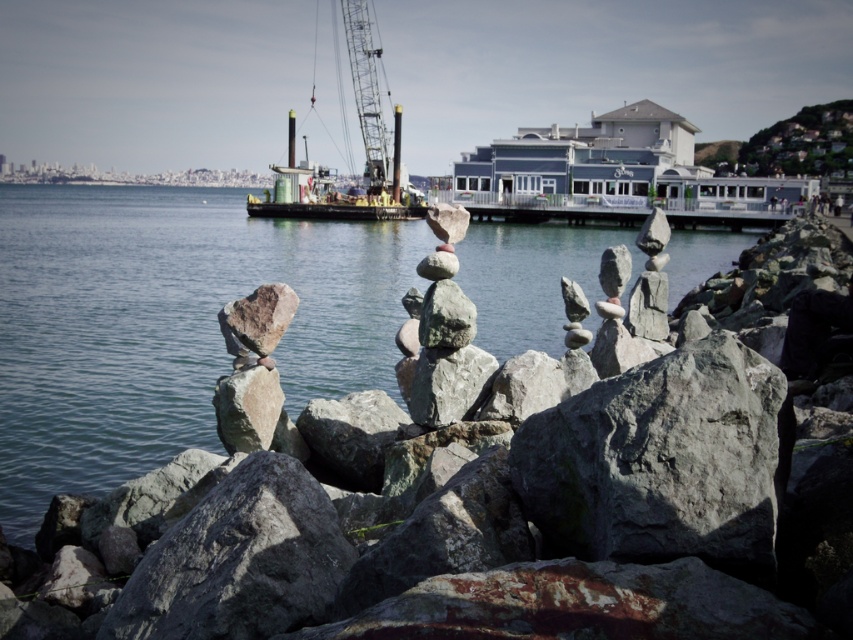
Question: Which of the following is the closest to the observer?

Choices:
 (A) (323, 253)
 (B) (369, 22)

Answer: (A)

Question: Does clear water at center have a smaller size compared to metallic gray crane at center?

Choices:
 (A) yes
 (B) no

Answer: (B)

Question: Does clear water at center appear over metallic gray crane at center?

Choices:
 (A) no
 (B) yes

Answer: (A)

Question: Is clear water at center further to the viewer compared to metallic gray crane at center?

Choices:
 (A) no
 (B) yes

Answer: (A)

Question: Which object is the farthest from the metallic yellow crane at upper center?

Choices:
 (A) metallic gray crane at center
 (B) clear water at center

Answer: (B)

Question: Estimate the real-world distances between objects in this image. Which object is closer to the clear water at center?

Choices:
 (A) metallic yellow crane at upper center
 (B) metallic gray crane at center

Answer: (A)